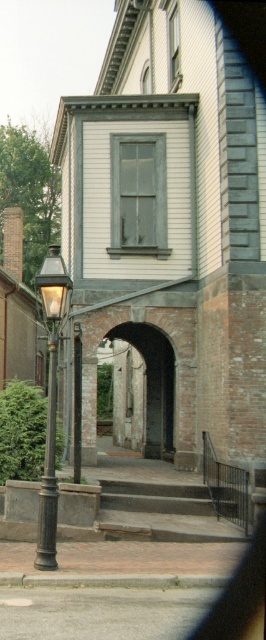
You are a visitor standing in front of the historic building and want to locate the teal glass window. Based on the coordinates provided, which object in the scene corresponds to the point at [138,195]?

The teal glass window at center corresponds to the point at [138,195].

Looking at this image, you are an architect designing a new addition to the building. You need to place a new rectangular skylight on the roof. The skylight must be positioned so that its bottom edge is exactly 1.2 meters above the teal glass window at center. What is the minimum height of the skylight from the ground to accommodate this requirement?

To determine the minimum height of the skylight from the ground, first calculate the height of the teal glass window at center. Since the skylight must be 1.2 meters above it, the total height would be the window height plus 1.2 meters. However, without knowing the exact elevation of the window, we cannot provide a numerical answer. Please provide the window height for further calculation.